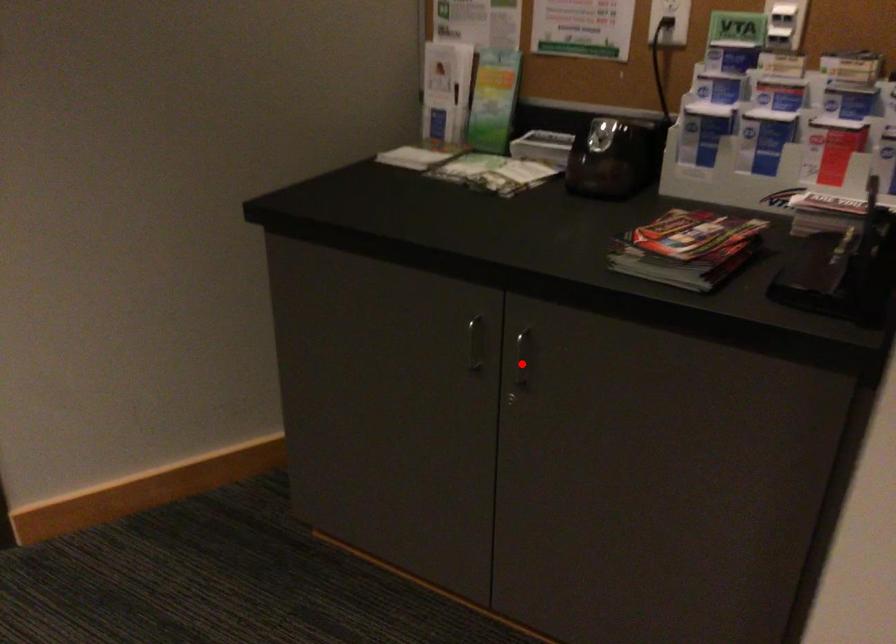
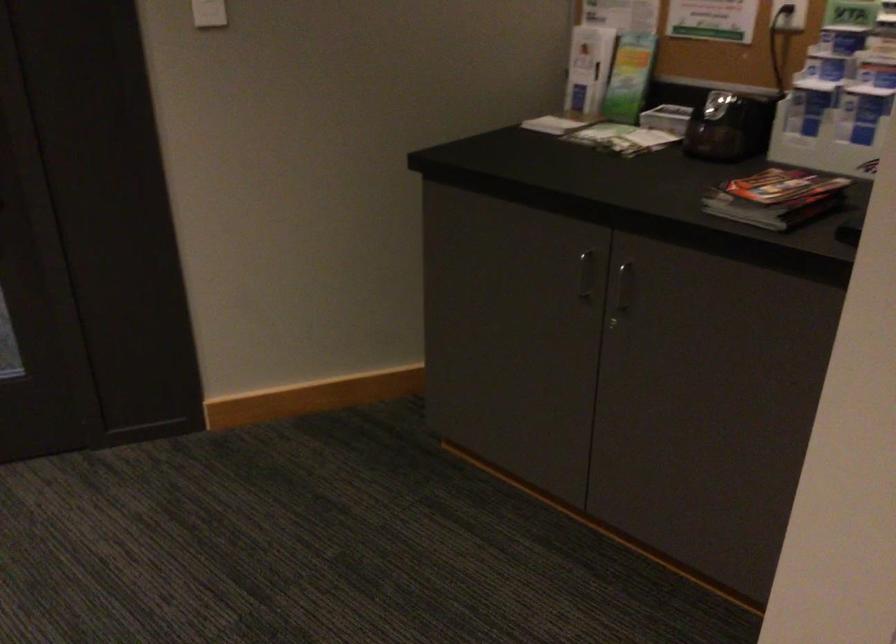
Question: I am providing you with two images of the same scene from different viewpoints. A red point is shown in image1. For the corresponding object point in image2, is it positioned nearer or farther from the camera?

Choices:
 (A) Nearer
 (B) Farther

Answer: (B)